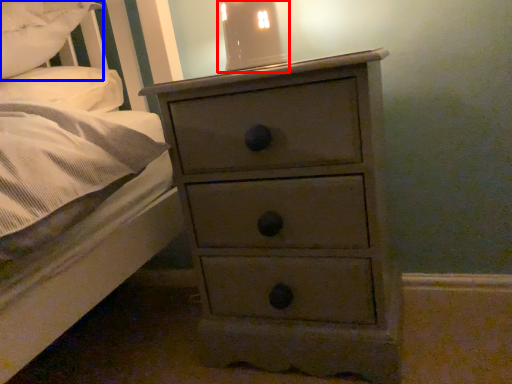
Question: Which object appears farthest to the camera in this image, bedside lamp (highlighted by a red box) or pillow (highlighted by a blue box)?

Choices:
 (A) bedside lamp
 (B) pillow

Answer: (A)